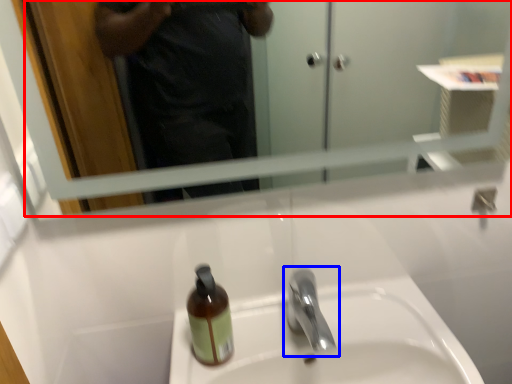
Question: Which object appears closest to the camera in this image, mirror (highlighted by a red box) or tap (highlighted by a blue box)?

Choices:
 (A) mirror
 (B) tap

Answer: (A)